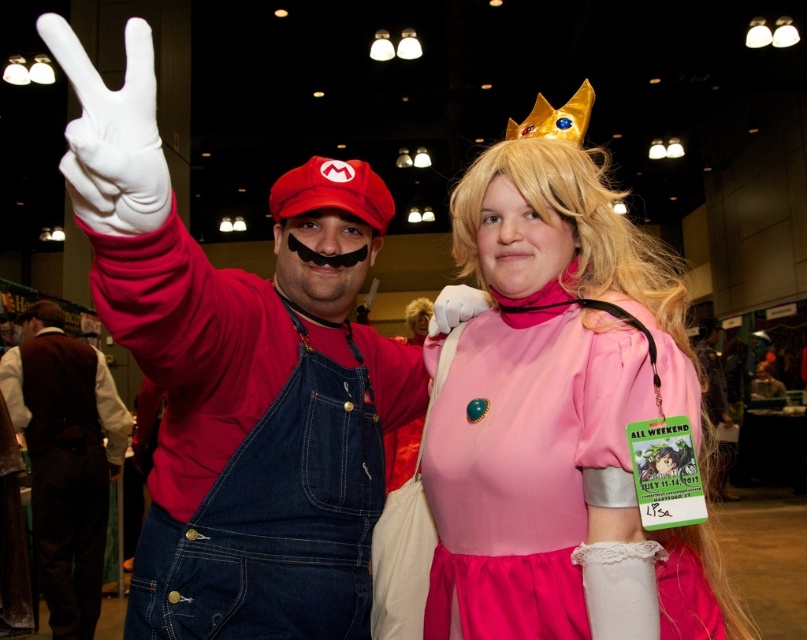
Which of these two, gold metallic crown at upper center or white matte glove at upper center, stands taller?

gold metallic crown at upper center is taller.

Is gold metallic crown at upper center below white matte glove at upper center?

Actually, gold metallic crown at upper center is above white matte glove at upper center.

Who is more forward, (x=561, y=122) or (x=442, y=323)?

Point (x=561, y=122) is more forward.

Find the location of a particular element. The height and width of the screenshot is (640, 807). gold metallic crown at upper center is located at coordinates (555, 116).

Is the position of pink satin dress at center less distant than that of denim overalls at center?

Yes, pink satin dress at center is in front of denim overalls at center.

At what (x,y) coordinates should I click in order to perform the action: click on pink satin dress at center. Please return your answer as a coordinate pair (x, y). This screenshot has width=807, height=640. Looking at the image, I should click on (559, 417).

Where is `pink satin dress at center`? Image resolution: width=807 pixels, height=640 pixels. pink satin dress at center is located at coordinates (559, 417).

Identify the location of pink satin dress at center. (559, 417).

Consider the image. Does denim overalls at center have a larger size compared to gold metallic crown at upper center?

Yes, denim overalls at center is bigger than gold metallic crown at upper center.

Who is more forward, (57, 616) or (534, 136)?

Point (534, 136) is more forward.

Describe the element at coordinates (65, 458) in the screenshot. This screenshot has width=807, height=640. I see `denim overalls at center` at that location.

What are the coordinates of `denim overalls at center` in the screenshot? It's located at (65, 458).